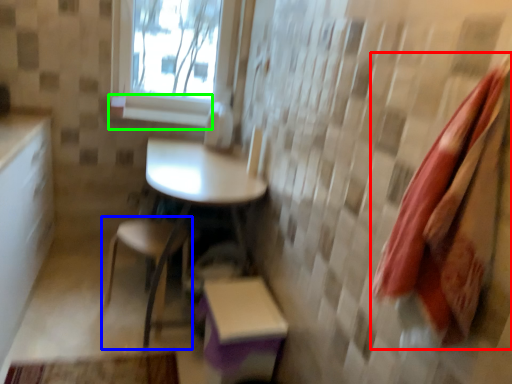
Question: Which object is positioned farthest from beach towel (highlighted by a red box)? Select from chair (highlighted by a blue box) and window sill (highlighted by a green box).

Choices:
 (A) chair
 (B) window sill

Answer: (B)